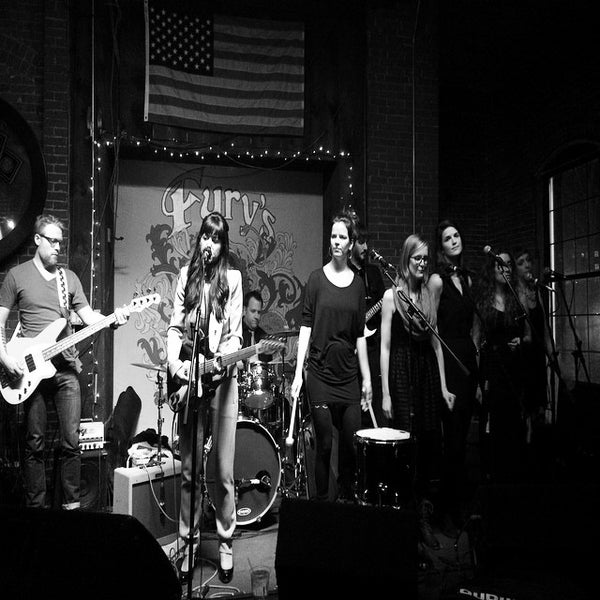
Locate an element on the screen. The height and width of the screenshot is (600, 600). speaker is located at coordinates (144, 506).